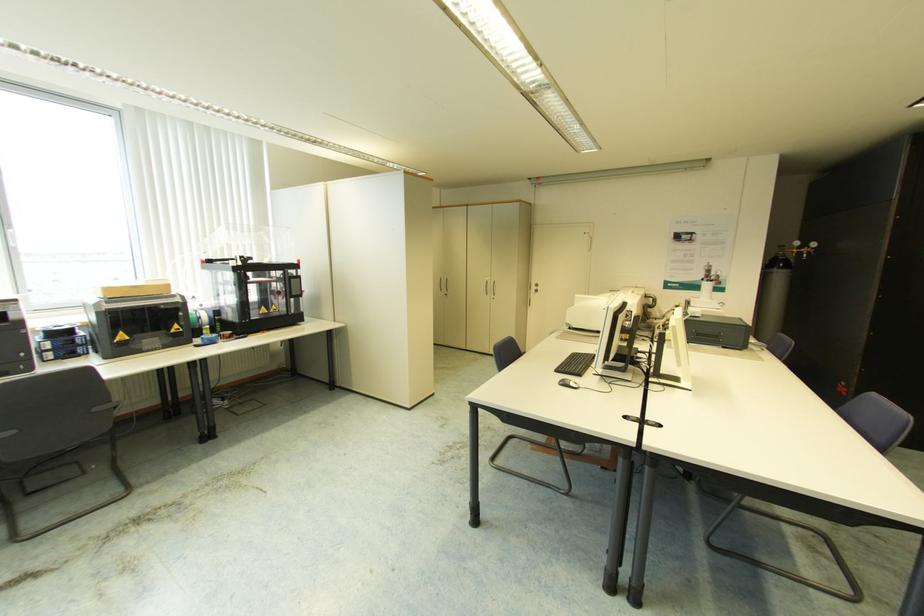
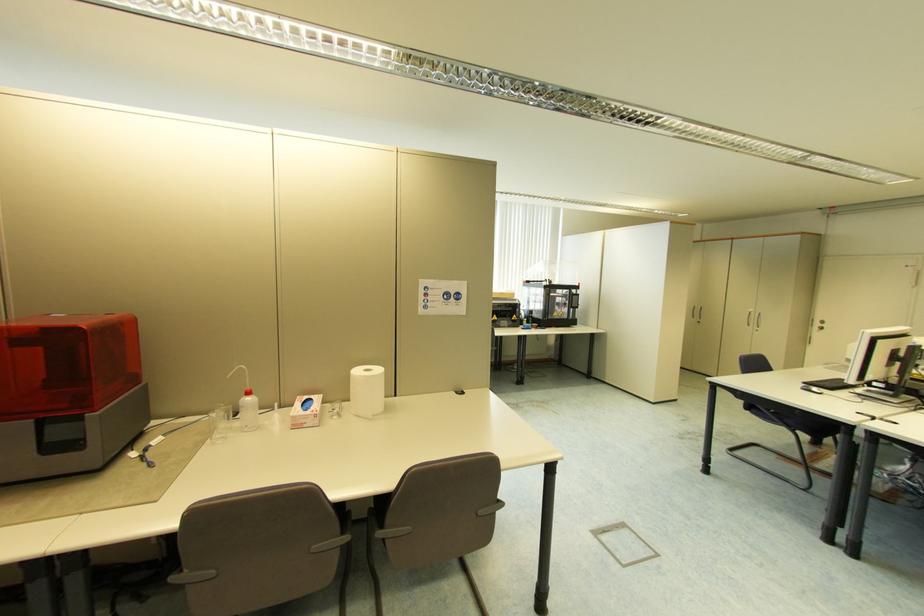
Find the pixel in the second image that matches (x=493, y=289) in the first image.

(758, 321)